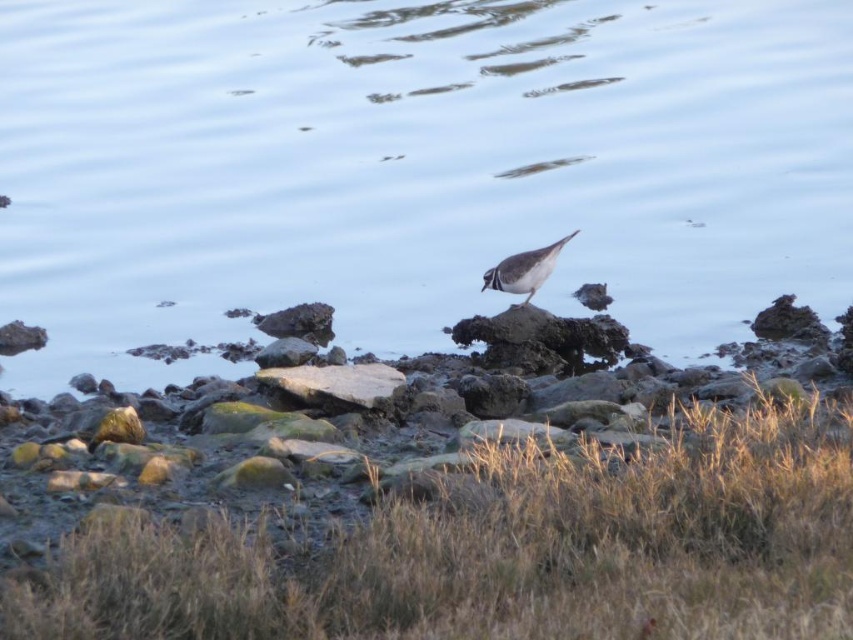
Question: Is rough textured rock at center to the right of brown speckled feathers at center from the viewer's perspective?

Choices:
 (A) yes
 (B) no

Answer: (B)

Question: Which point appears farthest from the camera in this image?

Choices:
 (A) (548, 259)
 (B) (10, 145)

Answer: (B)

Question: Does clear water at center lie behind rough textured rock at center?

Choices:
 (A) no
 (B) yes

Answer: (B)

Question: Can you confirm if rough textured rock at center is thinner than brown speckled feathers at center?

Choices:
 (A) yes
 (B) no

Answer: (B)

Question: Which is nearer to the rough textured rock at center?

Choices:
 (A) clear water at center
 (B) brown speckled feathers at center

Answer: (B)

Question: Which point appears farthest from the camera in this image?

Choices:
 (A) click(541, 259)
 (B) click(231, 184)

Answer: (B)